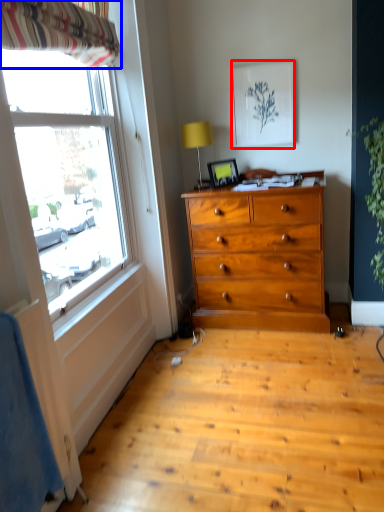
Question: Which point is further to the camera, picture frame (highlighted by a red box) or curtain (highlighted by a blue box)?

Choices:
 (A) picture frame
 (B) curtain

Answer: (A)